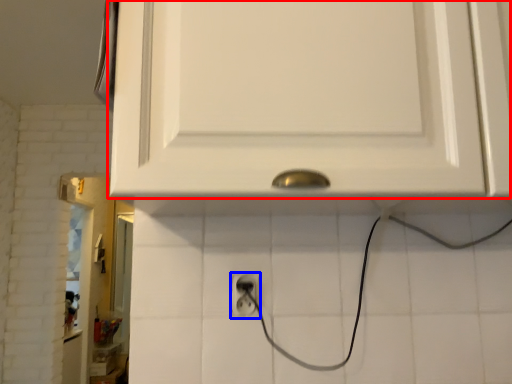
Question: Which object appears farthest to the camera in this image, cabinetry (highlighted by a red box) or power plugs and sockets (highlighted by a blue box)?

Choices:
 (A) cabinetry
 (B) power plugs and sockets

Answer: (B)